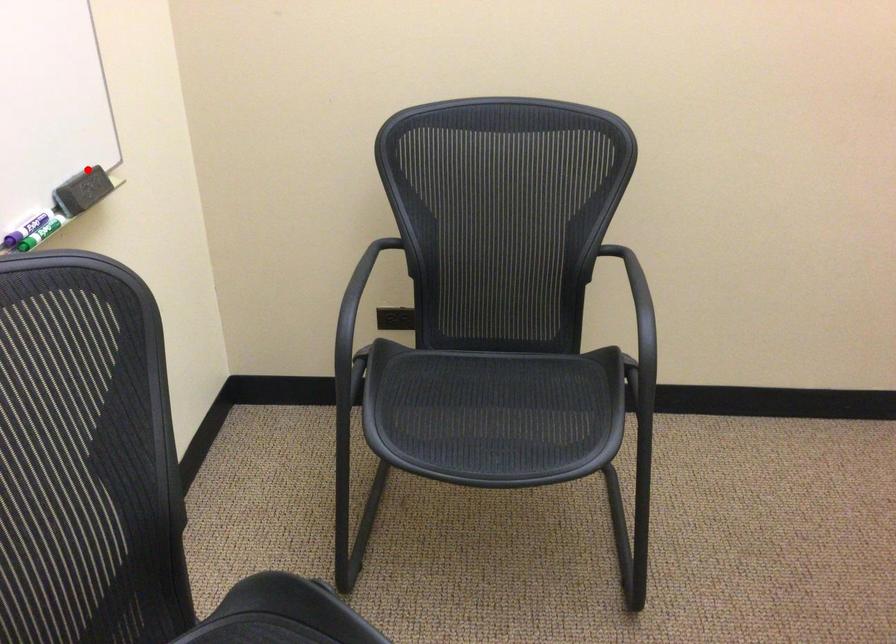
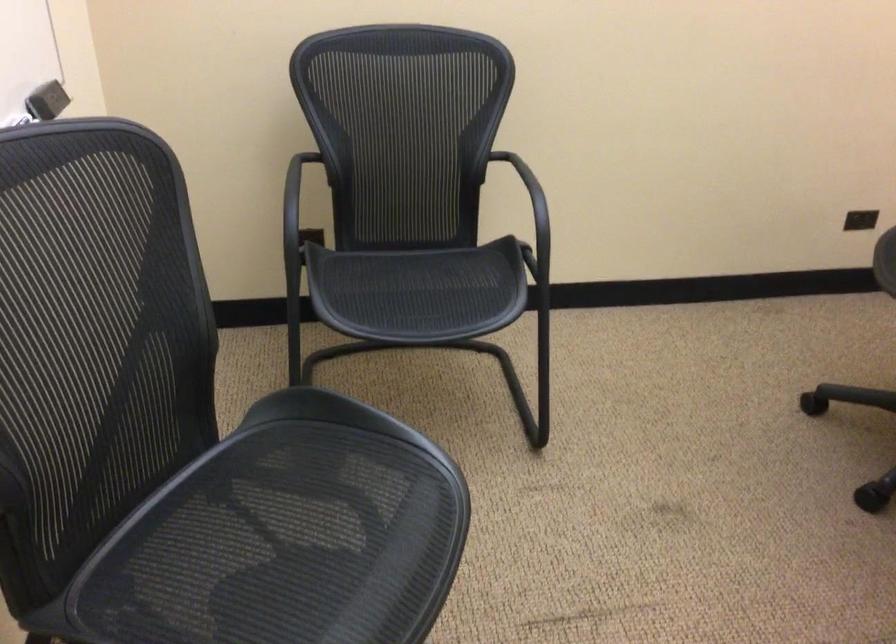
The point at the highlighted location is marked in the first image. Where is the corresponding point in the second image?

(49, 84)